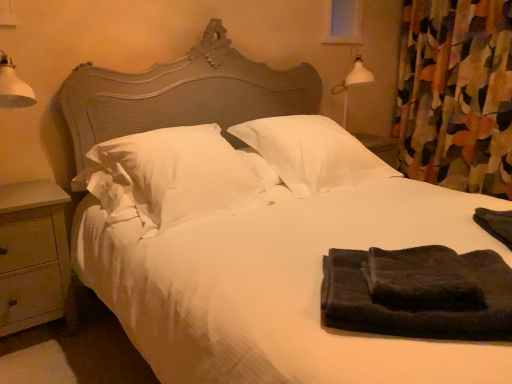
Question: Is transparent glass window screen at upper center located within wooden at left?

Choices:
 (A) yes
 (B) no

Answer: (B)

Question: Does wooden at left have a greater height compared to transparent glass window screen at upper center?

Choices:
 (A) yes
 (B) no

Answer: (A)

Question: Is wooden at left smaller than transparent glass window screen at upper center?

Choices:
 (A) yes
 (B) no

Answer: (B)

Question: Can you confirm if wooden at left is positioned to the left of transparent glass window screen at upper center?

Choices:
 (A) no
 (B) yes

Answer: (B)

Question: Are wooden at left and transparent glass window screen at upper center beside each other?

Choices:
 (A) yes
 (B) no

Answer: (B)

Question: From the image's perspective, is wooden at left above or below dark green towel at right, which appears as the 1th material when viewed from the back?

Choices:
 (A) below
 (B) above

Answer: (A)

Question: Based on their positions, is wooden at left located to the left or right of dark green towel at right, which is counted as the 2th material, starting from the left?

Choices:
 (A) left
 (B) right

Answer: (A)

Question: In terms of width, does wooden at left look wider or thinner when compared to dark green towel at right, which is counted as the 2th material, starting from the left?

Choices:
 (A) wide
 (B) thin

Answer: (A)

Question: From their relative heights in the image, would you say wooden at left is taller or shorter than dark green towel at right, the 2th material in the front-to-back sequence?

Choices:
 (A) tall
 (B) short

Answer: (A)

Question: Based on their sizes in the image, would you say dark green towel at right, acting as the 1th material starting from the right, is bigger or smaller than black terry towel at lower right, marked as the 2th material in a back-to-front arrangement?

Choices:
 (A) big
 (B) small

Answer: (B)

Question: Considering their positions, is dark green towel at right, which is counted as the 2th material, starting from the left, located in front of or behind black terry towel at lower right, which is the first material from front to back?

Choices:
 (A) front
 (B) behind

Answer: (B)

Question: Considering the positions of dark green towel at right, acting as the 1th material starting from the right, and black terry towel at lower right, which is the first material from front to back, in the image, is dark green towel at right, acting as the 1th material starting from the right, wider or thinner than black terry towel at lower right, which is the first material from front to back,?

Choices:
 (A) thin
 (B) wide

Answer: (A)

Question: From a real-world perspective, is dark green towel at right, which is counted as the 2th material, starting from the left, positioned above or below black terry towel at lower right, marked as the 2th material in a back-to-front arrangement?

Choices:
 (A) below
 (B) above

Answer: (B)

Question: Considering the positions of floral fabric curtain at right and white soft pillow at center, which appears as the first pillow when viewed from the right, in the image, is floral fabric curtain at right taller or shorter than white soft pillow at center, which appears as the first pillow when viewed from the right,?

Choices:
 (A) tall
 (B) short

Answer: (A)

Question: From a real-world perspective, is floral fabric curtain at right positioned above or below white soft pillow at center, which appears as the 2th pillow when viewed from the left?

Choices:
 (A) above
 (B) below

Answer: (A)